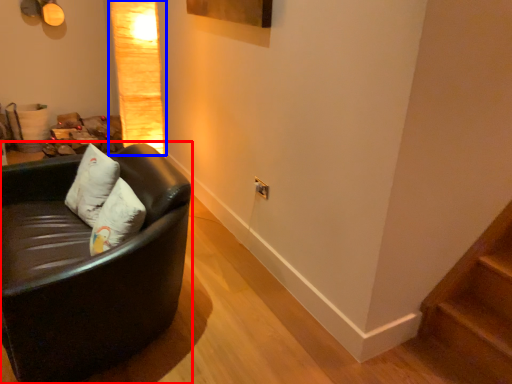
Question: Which of the following is the closest to the observer, studio couch (highlighted by a red box) or lamp (highlighted by a blue box)?

Choices:
 (A) studio couch
 (B) lamp

Answer: (A)